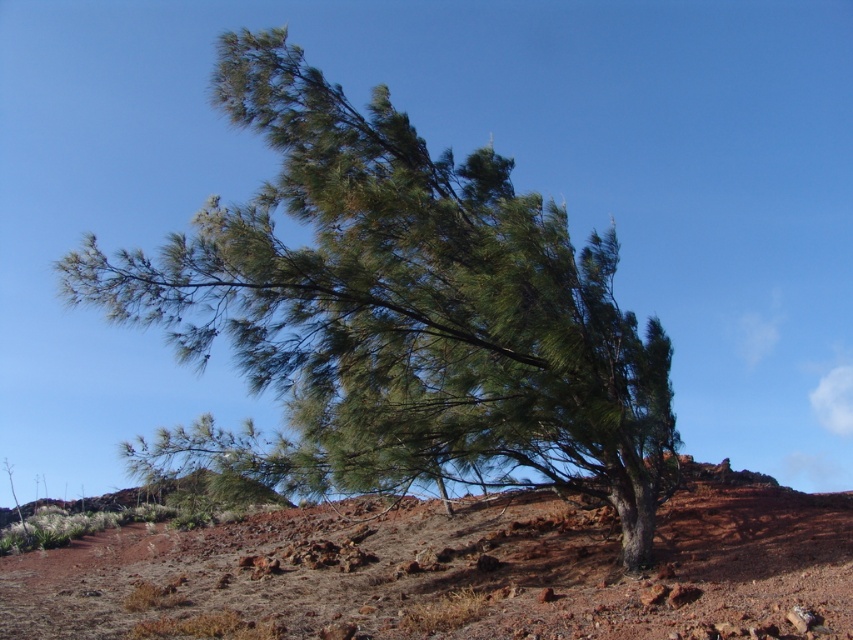
You are standing in front of the pine tree and want to place a small marker at both point (613, 449) and point (821, 566). Which point is closer to you?

Point (613, 449) is closer to you than point (821, 566) because it is further to the viewer.